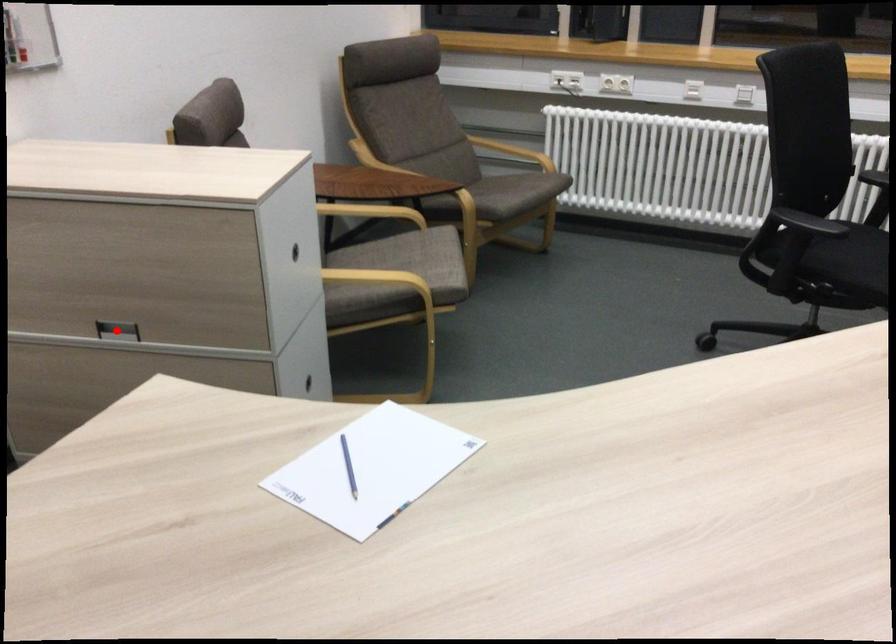
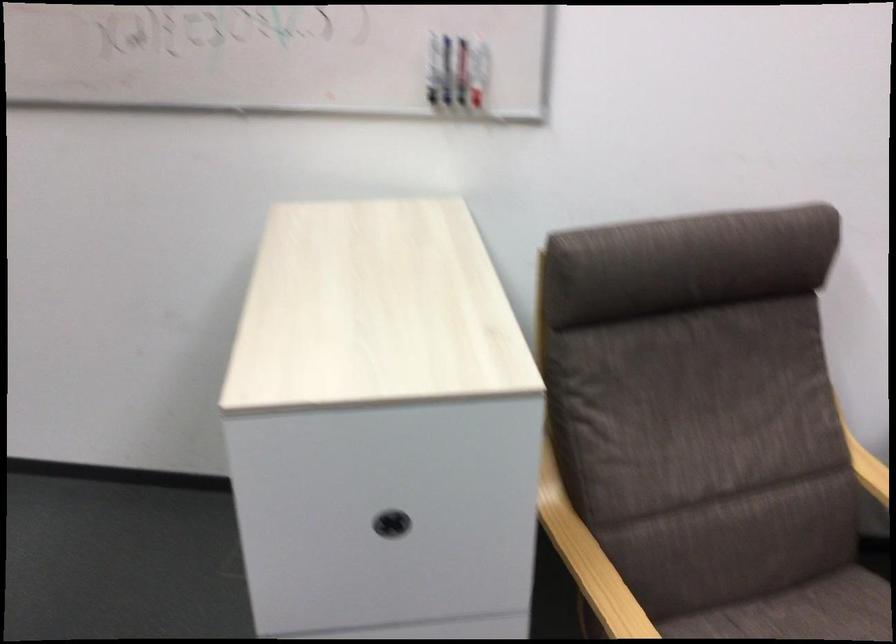
Question: I am providing you with two images of the same scene from different viewpoints. A red point is marked on the first image. At the location where the point appears in image 1, is it still visible in image 2?

Choices:
 (A) Yes
 (B) No

Answer: (B)